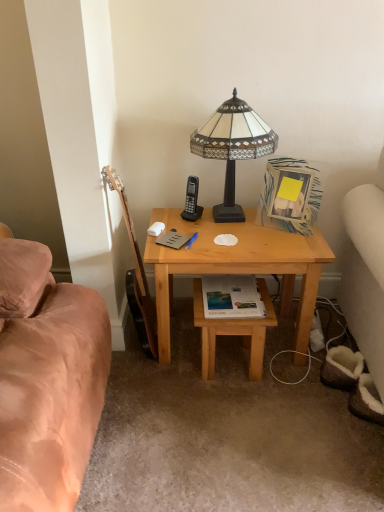
This screenshot has width=384, height=512. Find the location of `free space that is in between light brown wooden stool at lower center and light wood desk at center`. free space that is in between light brown wooden stool at lower center and light wood desk at center is located at coordinates (239, 373).